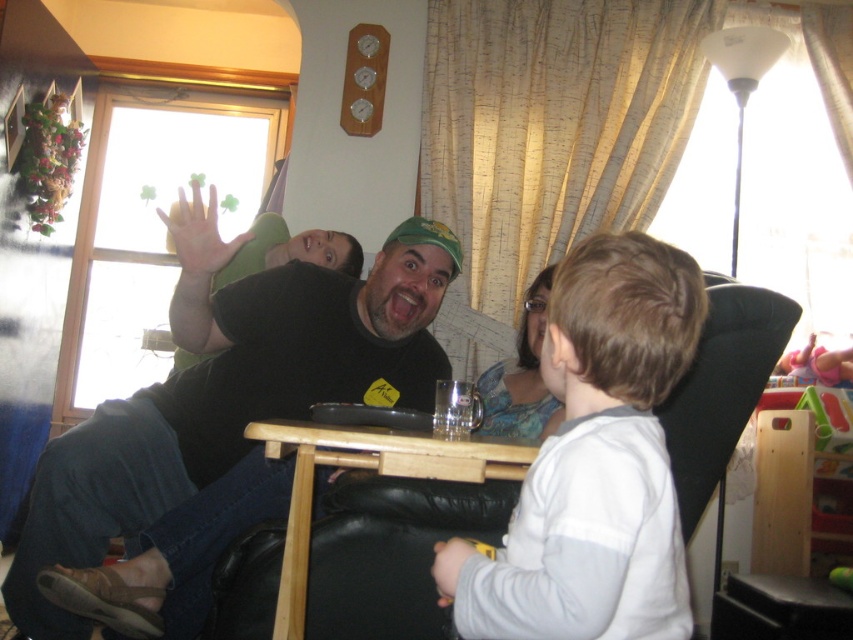
Between matte black shirt at center and blue floral dress at center, which one appears on the right side from the viewer's perspective?

blue floral dress at center is more to the right.

Does matte black shirt at center have a lesser height compared to blue floral dress at center?

No.

Where is `matte black shirt at center`? The width and height of the screenshot is (853, 640). matte black shirt at center is located at coordinates (341, 326).

This screenshot has width=853, height=640. I want to click on matte black shirt at center, so click(x=341, y=326).

How distant is white fleece shirt at center from matte black shirt at center?

white fleece shirt at center is 34.45 inches away from matte black shirt at center.

Which is behind, point (607, 307) or point (49, 580)?

Point (49, 580)

You are a GUI agent. You are given a task and a screenshot of the screen. Output one action in this format:
    pyautogui.click(x=<x>, y=<y>)
    Task: Click on the white fleece shirt at center
    This screenshot has width=853, height=640.
    Given the screenshot: What is the action you would take?
    pyautogui.click(x=599, y=460)

Is point (622, 552) farther from viewer compared to point (186, 246)?

No, (622, 552) is in front of (186, 246).

Can you confirm if white fleece shirt at center is shorter than white matte hand at upper center?

Incorrect, white fleece shirt at center's height does not fall short of white matte hand at upper center's.

Which is in front, point (619, 312) or point (190, 228)?

Point (619, 312) is more forward.

Find the location of a particular element. white fleece shirt at center is located at coordinates (599, 460).